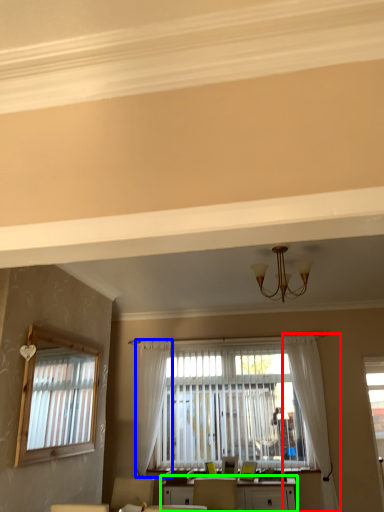
Question: Which object is positioned closest to curtain (highlighted by a red box)? Select from curtain (highlighted by a blue box) and table (highlighted by a green box).

Choices:
 (A) curtain
 (B) table

Answer: (B)